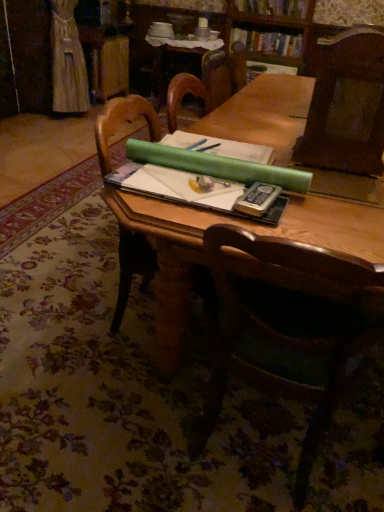
Question: From a real-world perspective, is hardcover book at center positioned above or below hardcover book at upper center, which is counted as the 2th book, starting from the top?

Choices:
 (A) below
 (B) above

Answer: (B)

Question: Considering their positions, is hardcover book at center located in front of or behind hardcover book at upper center, the 1th book when ordered from bottom to top?

Choices:
 (A) behind
 (B) front

Answer: (B)

Question: Estimate the real-world distances between objects in this image. Which object is farther from the hardcover book at upper center, which is counted as the 2th book, starting from the top?

Choices:
 (A) hardcover book at center
 (B) green paper at upper center
 (C) wooden table at center
 (D) green matte paper at center
 (E) wooden chair at center, which appears as the 1th chair when ordered from the bottom

Answer: (E)

Question: Based on their relative distances, which object is nearer to the hardcover book at upper center, positioned as the 2th book in bottom-to-top order?

Choices:
 (A) green paper at upper center
 (B) wooden table at center
 (C) dark wood chair at upper right, acting as the 2th chair starting from the bottom
 (D) wooden bookcase at upper center
 (E) wooden chair at center, arranged as the 2th chair when viewed from the top

Answer: (D)